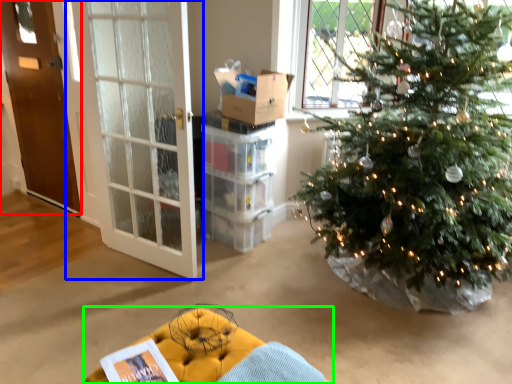
Question: Based on their relative distances, which object is farther from door (highlighted by a red box)? Choose from door (highlighted by a blue box) and furniture (highlighted by a green box).

Choices:
 (A) door
 (B) furniture

Answer: (B)